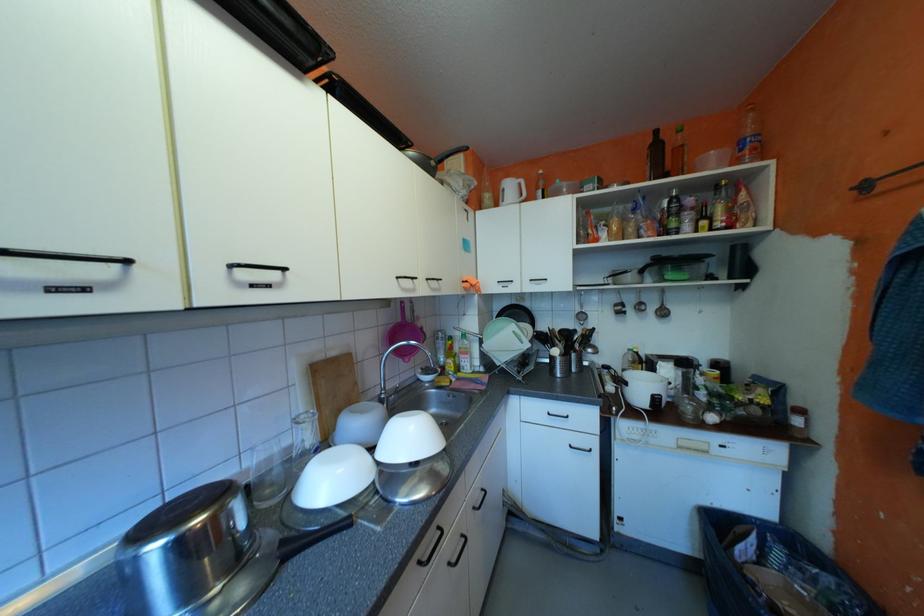
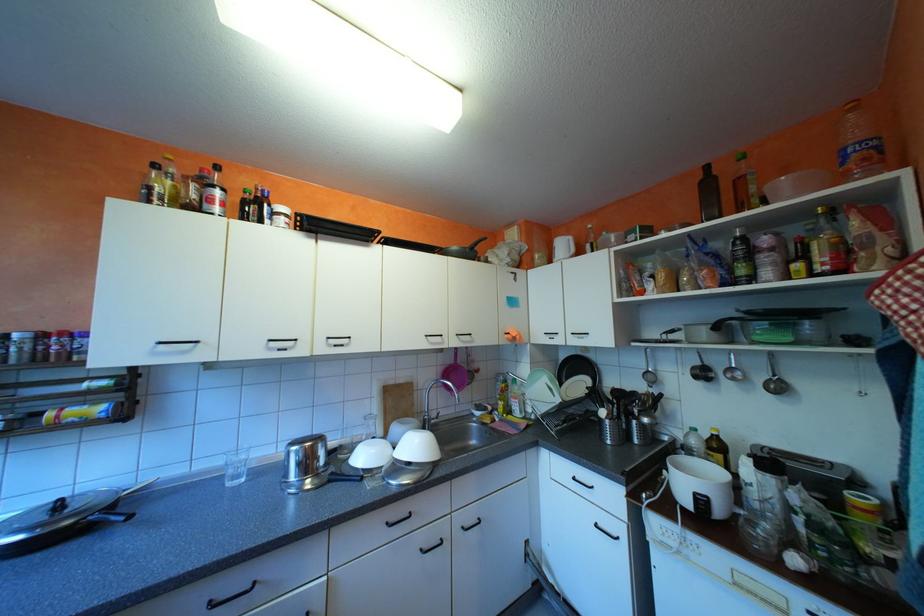
The point at (662,139) is marked in the first image. Where is the corresponding point in the second image?

(711, 176)